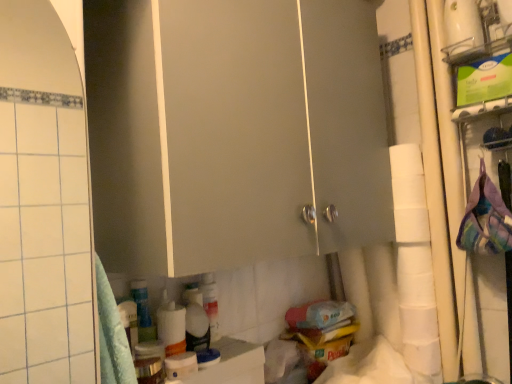
Question: Is white matte toilet paper at right in front of or behind matte white cabinet at center in the image?

Choices:
 (A) front
 (B) behind

Answer: (B)

Question: From the image's perspective, relative to matte white cabinet at center, is white matte toilet paper at right above or below?

Choices:
 (A) above
 (B) below

Answer: (B)

Question: Looking at the image, does white matte toilet paper at right seem bigger or smaller compared to matte white cabinet at center?

Choices:
 (A) big
 (B) small

Answer: (B)

Question: Based on their sizes in the image, would you say matte white cabinet at center is bigger or smaller than white matte toilet paper at right?

Choices:
 (A) big
 (B) small

Answer: (A)

Question: Is point (114, 38) closer or farther from the camera than point (429, 365)?

Choices:
 (A) closer
 (B) farther

Answer: (A)

Question: From the image's perspective, relative to white matte toilet paper at right, is matte white cabinet at center above or below?

Choices:
 (A) below
 (B) above

Answer: (B)

Question: From a real-world perspective, relative to white matte toilet paper at right, is matte white cabinet at center vertically above or below?

Choices:
 (A) below
 (B) above

Answer: (B)